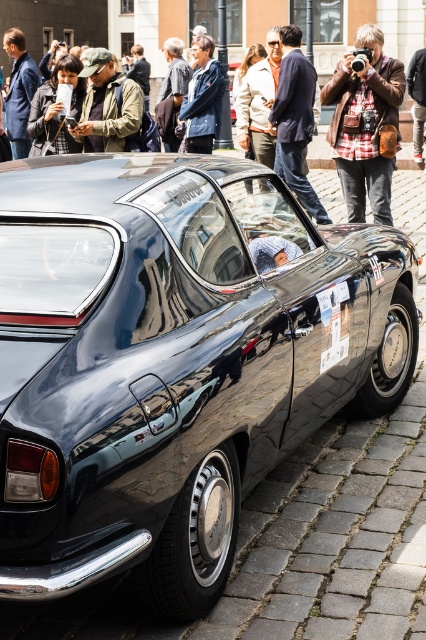
You are a photographer standing at the origin point of the coordinate system. You want to take a photo of the shiny black car at center. What are the coordinates of the car?

The coordinates of the shiny black car at center are at point (173, 360).

You are a photographer trying to capture the shiny black car at center and the matte black car at center in a single shot. Since both cars are black, how can you distinguish them in your photo?

The shiny black car at center is positioned under the matte black car at center, so you can distinguish them by their vertical positions in the photo.